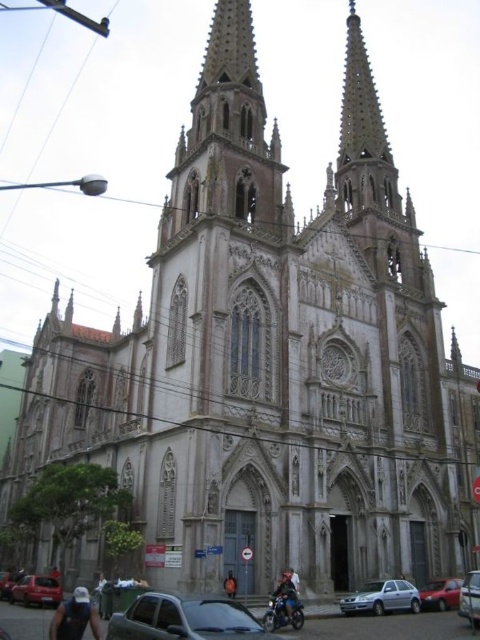
Can you confirm if matte black car at lower center is thinner than metallic silver car at center?

No.

Between matte black car at lower center and metallic silver car at center, which one appears on the left side from the viewer's perspective?

Positioned to the left is matte black car at lower center.

The image size is (480, 640). In order to click on matte black car at lower center in this screenshot , I will do `click(186, 620)`.

Between point (372, 596) and point (283, 595), which one is positioned in front?

Point (283, 595) is in front.

Can you confirm if silver metallic hatchback at lower center is positioned to the left of shiny black motorcycle at lower center?

In fact, silver metallic hatchback at lower center is to the right of shiny black motorcycle at lower center.

Identify the location of silver metallic hatchback at lower center. This screenshot has width=480, height=640. (383, 596).

Identify the location of silver metallic hatchback at lower center. (383, 596).

Which is more to the left, denim jacket at lower left or metallic silver car at center?

Positioned to the left is denim jacket at lower left.

Who is more distant from viewer, (87, 616) or (474, 616)?

Positioned behind is point (474, 616).

At what (x,y) coordinates should I click in order to perform the action: click on denim jacket at lower left. Please return your answer as a coordinate pair (x, y). The height and width of the screenshot is (640, 480). Looking at the image, I should click on (74, 616).